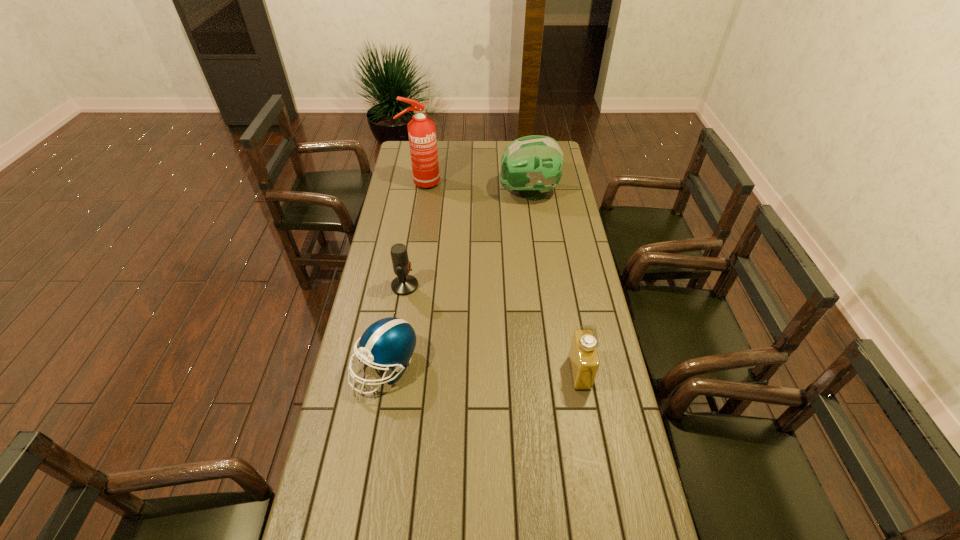
In order to click on vacant space located 0.390m on the visor of the right football helmet in this screenshot , I will do `click(416, 193)`.

At what (x,y) coordinates should I click in order to perform the action: click on vacant point located on the front-facing side of the perfume. Please return your answer as a coordinate pair (x, y). Looking at the image, I should click on (468, 373).

You are a GUI agent. You are given a task and a screenshot of the screen. Output one action in this format:
    pyautogui.click(x=<x>, y=<y>)
    Task: Click on the free location located 0.230m on the front-facing side of the perfume
    
    Given the screenshot: What is the action you would take?
    pyautogui.click(x=498, y=373)

Locate an element on the screen. vacant space located 0.070m on the front-facing side of the perfume is located at coordinates (548, 373).

Identify the location of vacant region located on the side of the microphone with the red ring. This screenshot has height=540, width=960. (439, 286).

Find the location of a particular element. The image size is (960, 540). vacant space located 0.330m at the front of the nearer football helmet with the faceguard is located at coordinates (359, 517).

Find the location of a particular element. The image size is (960, 540). fire extinguisher located in the left edge section of the desktop is located at coordinates (421, 130).

Where is `microphone that is at the left edge`? This screenshot has height=540, width=960. microphone that is at the left edge is located at coordinates (404, 284).

This screenshot has height=540, width=960. Find the location of `football helmet that is at the left edge`. football helmet that is at the left edge is located at coordinates (389, 342).

Where is `football helmet that is at the right edge`? This screenshot has height=540, width=960. football helmet that is at the right edge is located at coordinates (531, 165).